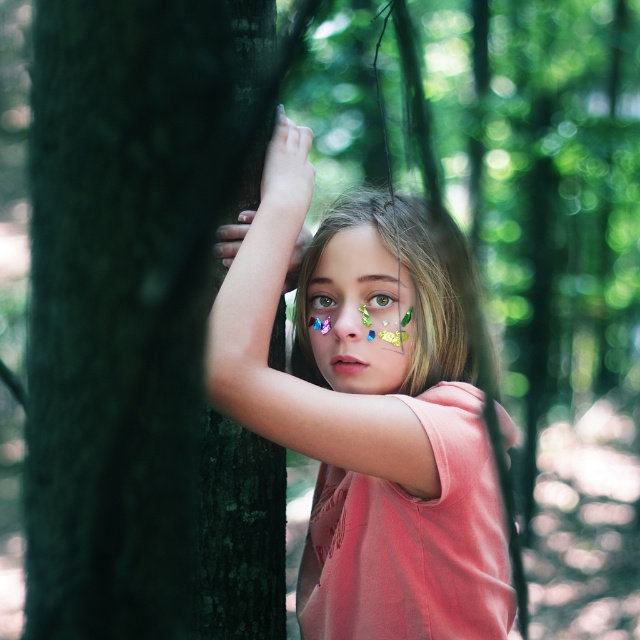
Does pink matte shirt at center appear over green iridescent eye at center?

No, pink matte shirt at center is not above green iridescent eye at center.

Between point (403, 253) and point (397, 300), which one is positioned in front?

Point (397, 300) is in front.

Between point (371, 616) and point (372, 294), which one is positioned in front?

Point (371, 616)

What are the coordinates of `pink matte shirt at center` in the screenshot? It's located at (368, 412).

In the scene shown: Between shiny metallic face at center and brown matte eye at center, which one has more height?

shiny metallic face at center is taller.

The width and height of the screenshot is (640, 640). In order to click on shiny metallic face at center in this screenshot , I will do `click(358, 314)`.

Between dark green bark at left and brown matte eye at center, which one is positioned lower?

brown matte eye at center

Can you confirm if dark green bark at left is taller than brown matte eye at center?

Yes, dark green bark at left is taller than brown matte eye at center.

The height and width of the screenshot is (640, 640). What do you see at coordinates (134, 320) in the screenshot? I see `dark green bark at left` at bounding box center [134, 320].

Identify the location of dark green bark at left. (134, 320).